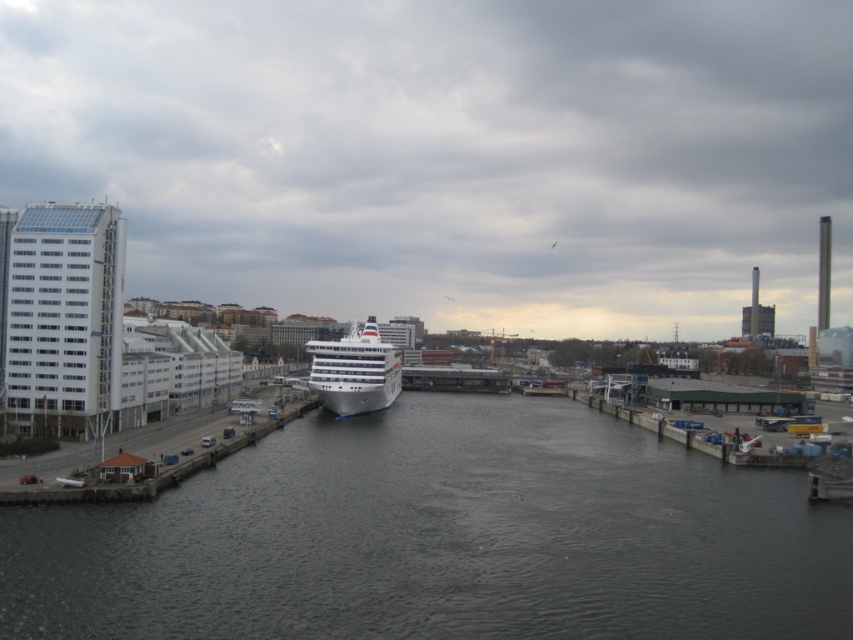
Is dark gray water at center further to the viewer compared to white glossy cruise ship at center?

No, it is not.

From the picture: Which of these two, dark gray water at center or white glossy cruise ship at center, stands shorter?

Standing shorter between the two is dark gray water at center.

Which is in front, point (675, 448) or point (331, 388)?

Point (675, 448) is in front.

Image resolution: width=853 pixels, height=640 pixels. I want to click on dark gray water at center, so click(440, 538).